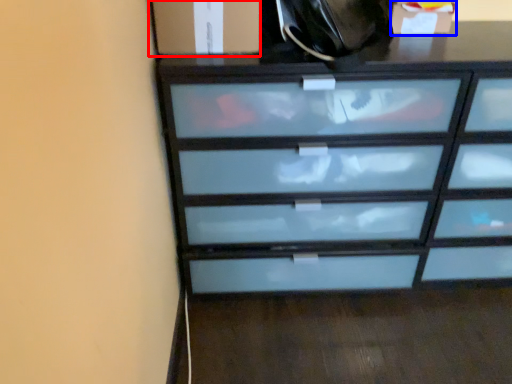
Question: Which object is closer to the camera taking this photo, cabinetry (highlighted by a red box) or cabinetry (highlighted by a blue box)?

Choices:
 (A) cabinetry
 (B) cabinetry

Answer: (A)